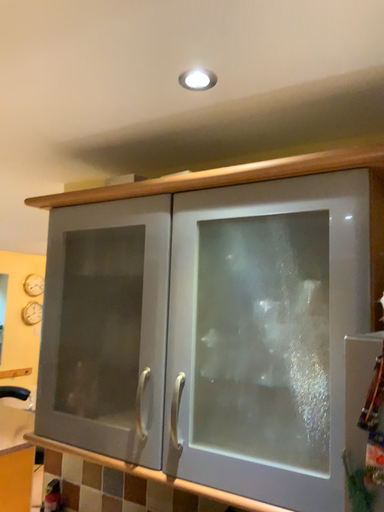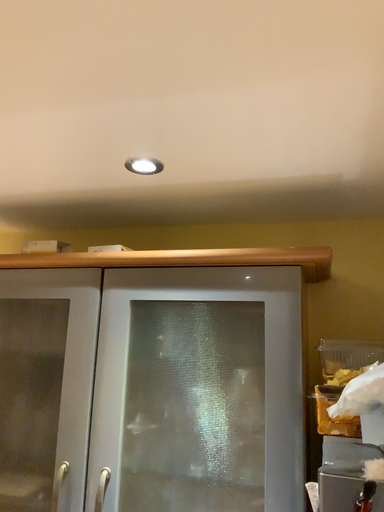
Question: How did the camera likely rotate when shooting the video?

Choices:
 (A) rotated right
 (B) rotated left

Answer: (A)